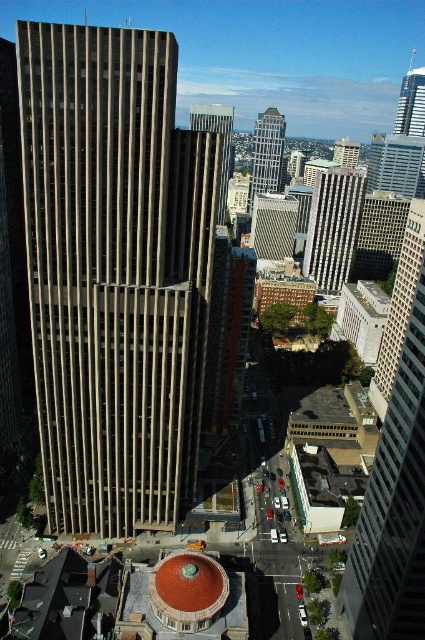
You are a drone operator trying to capture aerial footage of the glassy silver skyscraper at center and the smooth concrete skyscraper at center. From your current position, which skyscraper would appear closer to you in the camera view?

The glassy silver skyscraper at center would appear closer to you in the camera view because the smooth concrete skyscraper at center is positioned behind it.